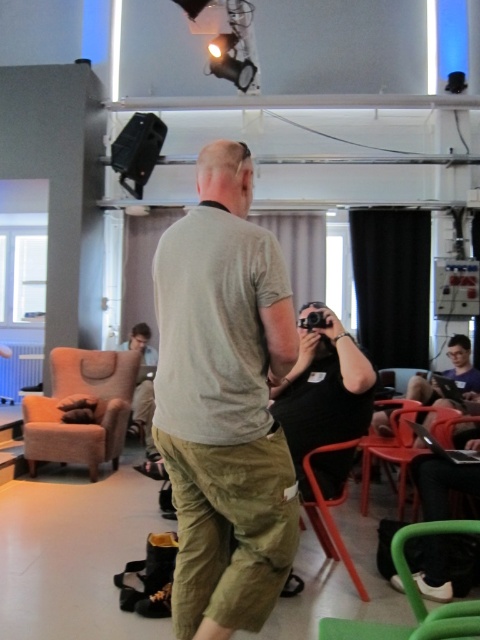
Is black matte camera at center taller than matte black camera at lower center?

In fact, black matte camera at center may be shorter than matte black camera at lower center.

Between black matte camera at center and matte black camera at lower center, which one appears on the left side from the viewer's perspective?

From the viewer's perspective, matte black camera at lower center appears more on the left side.

Does point (365, 419) lie behind point (142, 428)?

No, it is not.

Where is `black matte camera at center`? black matte camera at center is located at coordinates (x=324, y=392).

Consider the image. Who is more distant from viewer, (220, 500) or (420, 611)?

Positioned behind is point (220, 500).

Which is behind, point (205, 336) or point (406, 573)?

Positioned behind is point (205, 336).

Identify the location of khaki pants at center. The image size is (480, 640). [x=225, y=403].

Which is more to the right, orange plastic chair at lower center or black plastic video camera at center?

From the viewer's perspective, orange plastic chair at lower center appears more on the right side.

Does point (408, 419) lie behind point (315, 314)?

Yes, point (408, 419) is farther from viewer.

You are a GUI agent. You are given a task and a screenshot of the screen. Output one action in this format:
    pyautogui.click(x=<x>, y=<y>)
    Task: Click on the orange plastic chair at lower center
    
    Given the screenshot: What is the action you would take?
    pyautogui.click(x=392, y=452)